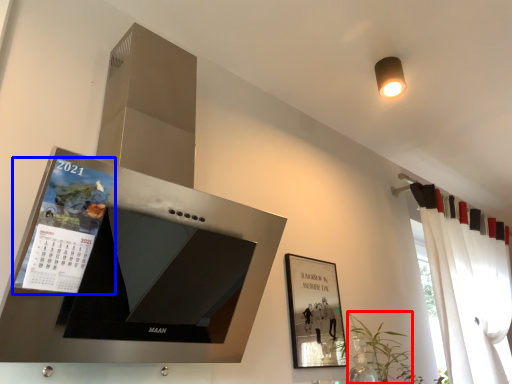
Question: Which point is closer to the camera, plant (highlighted by a red box) or magazine (highlighted by a blue box)?

Choices:
 (A) plant
 (B) magazine

Answer: (B)